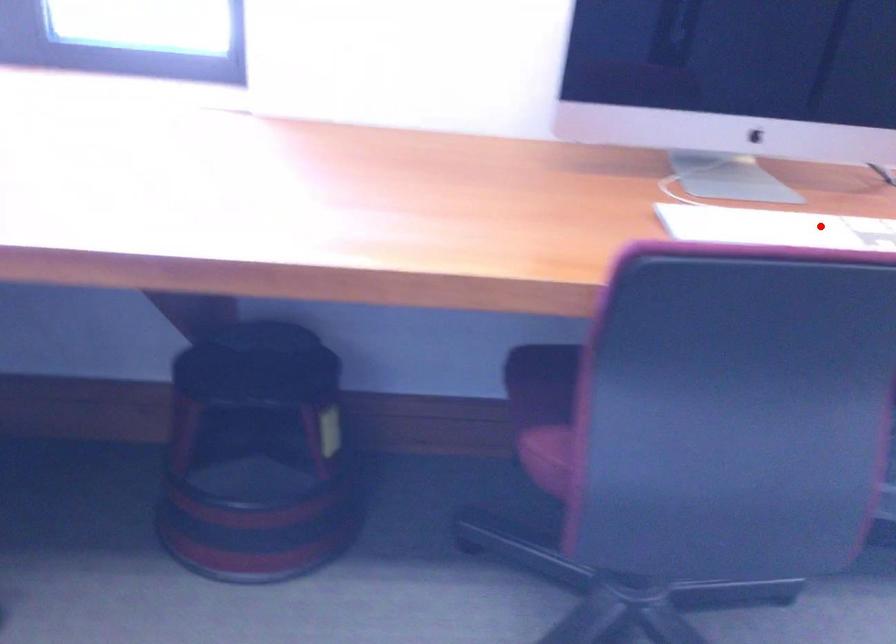
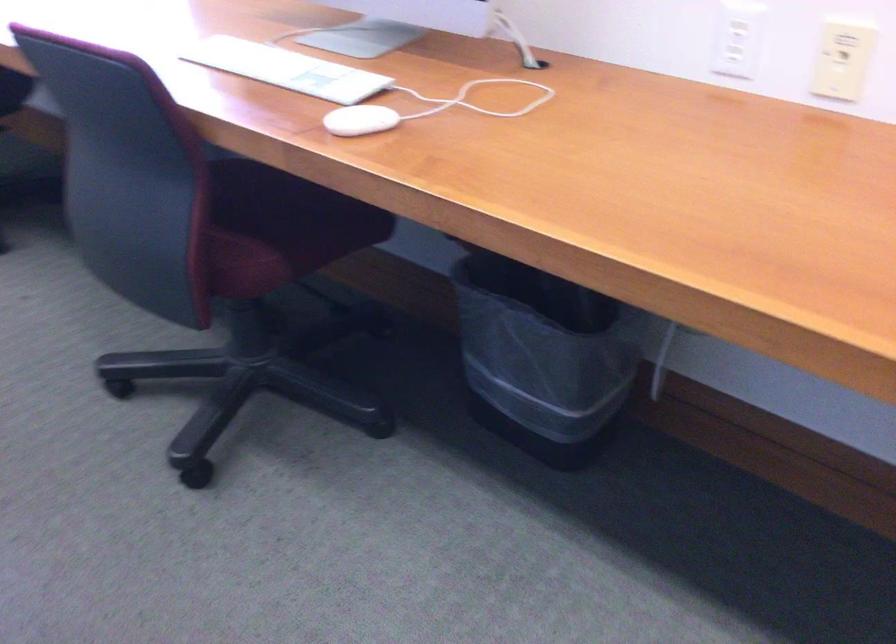
Find the pixel in the second image that matches the highlighted location in the first image.

(286, 69)